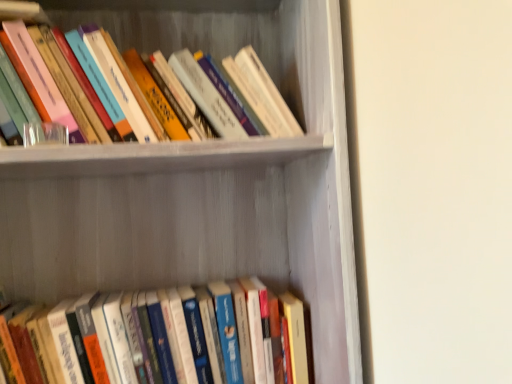
Question: Is hardcover books at upper left, which is the 2th book from bottom to top, closer to camera compared to white matte bookshelf at upper center?

Choices:
 (A) yes
 (B) no

Answer: (B)

Question: Is the depth of hardcover books at upper left, which ranks as the first book in top-to-bottom order, greater than that of white matte bookshelf at upper center?

Choices:
 (A) yes
 (B) no

Answer: (A)

Question: Is hardcover books at upper left, which ranks as the first book in top-to-bottom order, beside white matte bookshelf at upper center?

Choices:
 (A) yes
 (B) no

Answer: (B)

Question: Is hardcover books at upper left, which is the 2th book from bottom to top, far from white matte bookshelf at upper center?

Choices:
 (A) no
 (B) yes

Answer: (A)

Question: Considering the relative sizes of hardcover books at upper left, which ranks as the first book in top-to-bottom order, and white matte bookshelf at upper center in the image provided, is hardcover books at upper left, which ranks as the first book in top-to-bottom order, shorter than white matte bookshelf at upper center?

Choices:
 (A) no
 (B) yes

Answer: (B)

Question: Is hardcover books at lower center, positioned as the 1th book in bottom-to-top order, situated inside white matte bookshelf at upper center or outside?

Choices:
 (A) outside
 (B) inside

Answer: (B)

Question: Is hardcover books at lower center, placed as the second book when sorted from top to bottom, taller or shorter than white matte bookshelf at upper center?

Choices:
 (A) short
 (B) tall

Answer: (A)

Question: Does point click(47, 375) appear closer or farther from the camera than point click(97, 180)?

Choices:
 (A) farther
 (B) closer

Answer: (B)

Question: Is hardcover books at lower center, placed as the second book when sorted from top to bottom, to the left or to the right of white matte bookshelf at upper center in the image?

Choices:
 (A) right
 (B) left

Answer: (B)

Question: Choose the correct answer: Is hardcover books at upper left, which ranks as the first book in top-to-bottom order, inside white matte bookshelf at upper center or outside it?

Choices:
 (A) inside
 (B) outside

Answer: (A)

Question: Looking at their shapes, would you say hardcover books at upper left, which is the 2th book from bottom to top, is wider or thinner than white matte bookshelf at upper center?

Choices:
 (A) wide
 (B) thin

Answer: (B)

Question: From a real-world perspective, is hardcover books at upper left, which ranks as the first book in top-to-bottom order, above or below white matte bookshelf at upper center?

Choices:
 (A) above
 (B) below

Answer: (A)

Question: Relative to white matte bookshelf at upper center, is hardcover books at upper left, which ranks as the first book in top-to-bottom order, in front or behind?

Choices:
 (A) front
 (B) behind

Answer: (B)

Question: Is white matte bookshelf at upper center in front of or behind hardcover books at upper left, which is the 2th book from bottom to top, in the image?

Choices:
 (A) behind
 (B) front

Answer: (B)

Question: From a real-world perspective, is white matte bookshelf at upper center physically located above or below hardcover books at upper left, which ranks as the first book in top-to-bottom order?

Choices:
 (A) below
 (B) above

Answer: (A)